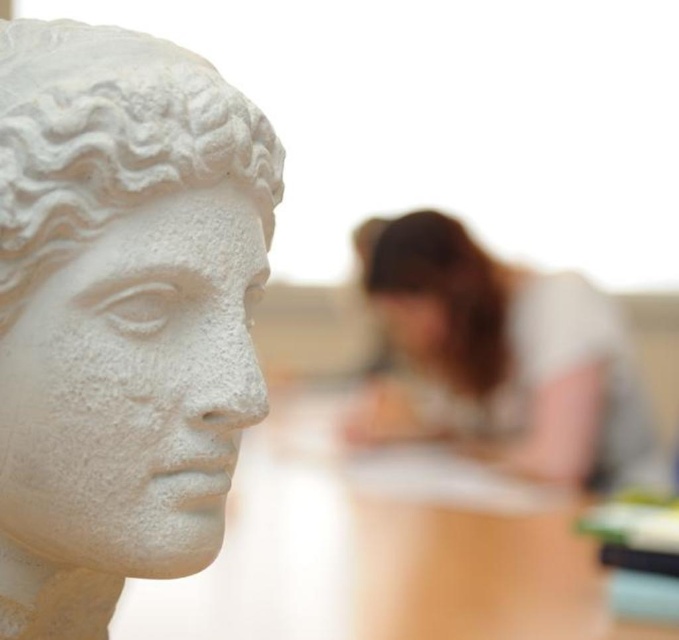
You are an art student who wants to sketch the scene. You notice the white marble statue at left and the smooth brown hair at center. Which object is closer to you?

The white marble statue at left is closer to you because it is in front of the smooth brown hair at center.